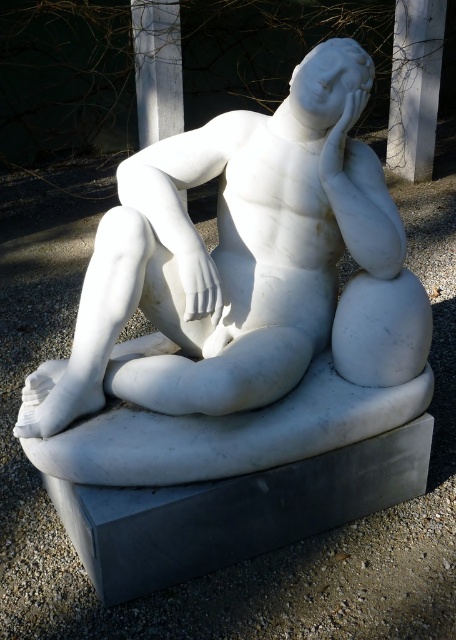
Question: Which point appears closest to the camera in this image?

Choices:
 (A) (425, 22)
 (B) (118, 211)

Answer: (B)

Question: Can you confirm if white marble statue at center is smaller than white marble pillar at upper center?

Choices:
 (A) no
 (B) yes

Answer: (A)

Question: Is white marble statue at center further to the viewer compared to white marble pillar at upper center?

Choices:
 (A) yes
 (B) no

Answer: (B)

Question: Which of the following is the closest to the observer?

Choices:
 (A) (419, 168)
 (B) (243, 195)

Answer: (B)

Question: Does white marble statue at center appear under white marble pillar at upper center?

Choices:
 (A) yes
 (B) no

Answer: (A)